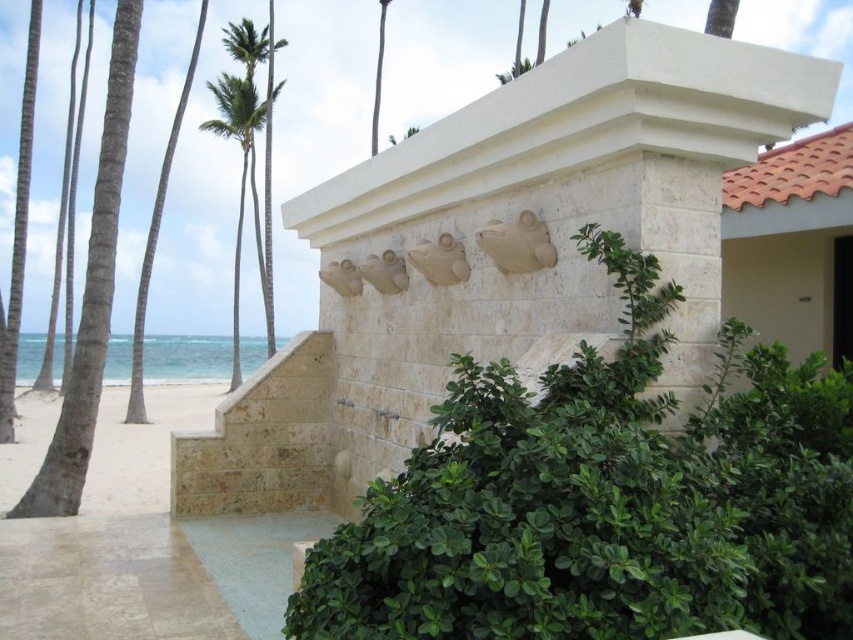
From the picture: You are a tourist standing at the base of the natural stone stairs at center and want to take a photo of the white stone sculpture at center. In which direction should you move relative to the stairs to get a clear view of the sculpture?

The white stone sculpture at center is positioned on the right side of the natural stone stairs at center, so you should move to the right of the stairs to get a clear view of the sculpture.

You are standing at the beach and want to walk towards the point labeled as point (126, 403). Which direction should you go relative to point (247, 156)?

You should walk towards point (126, 403), which is in front of point (247, 156).